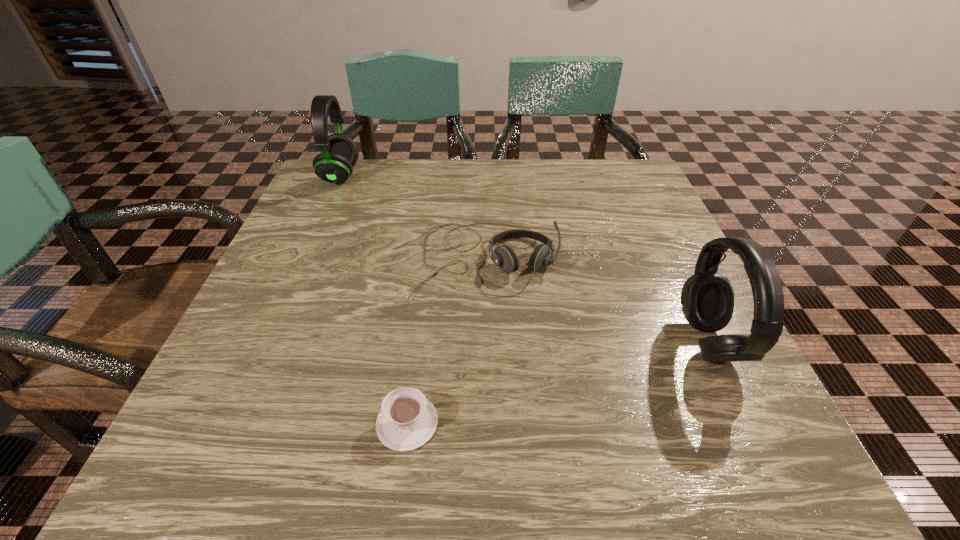
Identify the location of vacant area that lies between the shortest object and the rightmost object. (558, 382).

Find the location of a particular element. The width and height of the screenshot is (960, 540). free space between the leftmost headset and the rightmost headset is located at coordinates (524, 259).

You are a GUI agent. You are given a task and a screenshot of the screen. Output one action in this format:
    pyautogui.click(x=<x>, y=<y>)
    Task: Click on the empty space that is in between the shortest headset and the rightmost object
    The height and width of the screenshot is (540, 960).
    Given the screenshot: What is the action you would take?
    pyautogui.click(x=596, y=301)

The width and height of the screenshot is (960, 540). Identify the location of free space between the rightmost headset and the second headset from right to left. (596, 301).

Identify the location of free space between the farthest headset and the shortest headset. This screenshot has height=540, width=960. (413, 218).

Where is `vacant region between the shortest headset and the farthest object`? vacant region between the shortest headset and the farthest object is located at coordinates (413, 218).

What are the coordinates of `free point between the leftmost object and the rightmost object` in the screenshot? It's located at point(524,259).

This screenshot has width=960, height=540. In order to click on the closest object to the second shortest object in this screenshot , I will do `click(707, 297)`.

Identify the location of object that is the third closest to the shortest object. Image resolution: width=960 pixels, height=540 pixels. (339, 153).

Image resolution: width=960 pixels, height=540 pixels. What are the coordinates of `headset that is the closest to the rightmost object` in the screenshot? It's located at (503, 256).